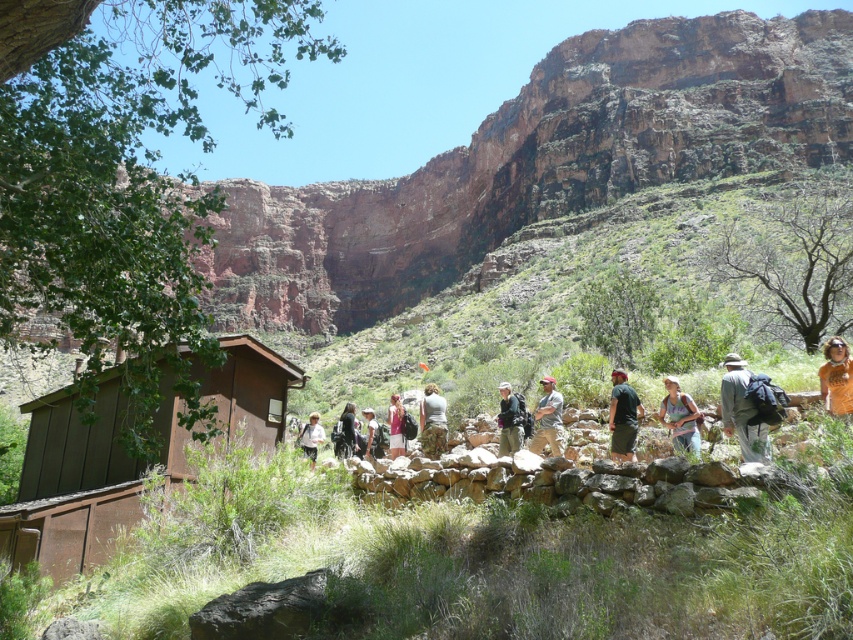
Question: Among these points, which one is nearest to the camera?

Choices:
 (A) (541, 445)
 (B) (363, 451)
 (C) (316, 444)

Answer: (A)

Question: Does orange cotton shirt at center appear over camouflage fabric backpack at center?

Choices:
 (A) yes
 (B) no

Answer: (A)

Question: Among these points, which one is nearest to the camera?

Choices:
 (A) (679, 451)
 (B) (828, 368)
 (C) (422, 445)

Answer: (A)

Question: Does orange cotton shirt at center appear over white cotton shirt at center?

Choices:
 (A) yes
 (B) no

Answer: (A)

Question: Is green fabric pants at center in front of camouflage pants at center?

Choices:
 (A) yes
 (B) no

Answer: (A)

Question: Among these objects, which one is farthest from the camera?

Choices:
 (A) orange cotton shirt at center
 (B) camouflage fabric backpack at center
 (C) matte khaki pants at center

Answer: (B)